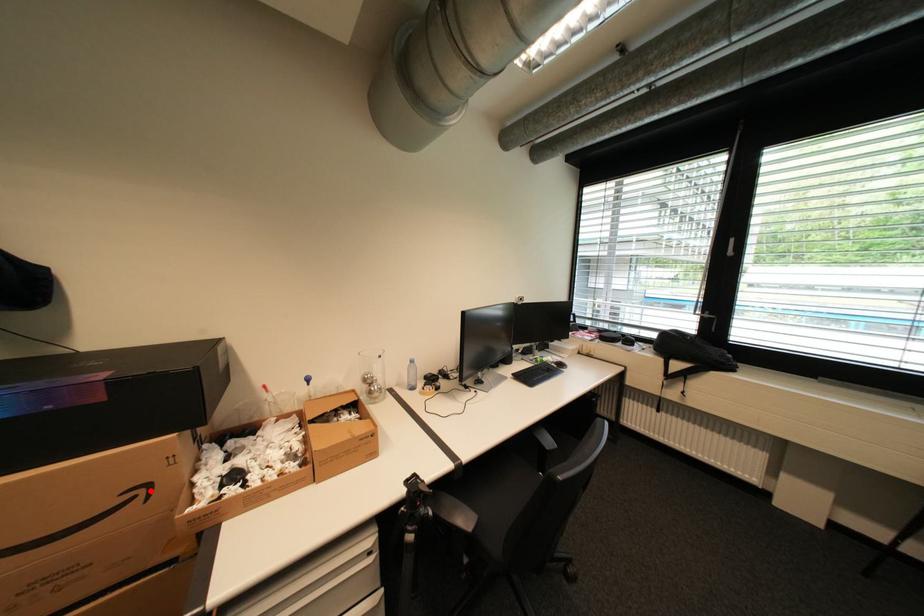
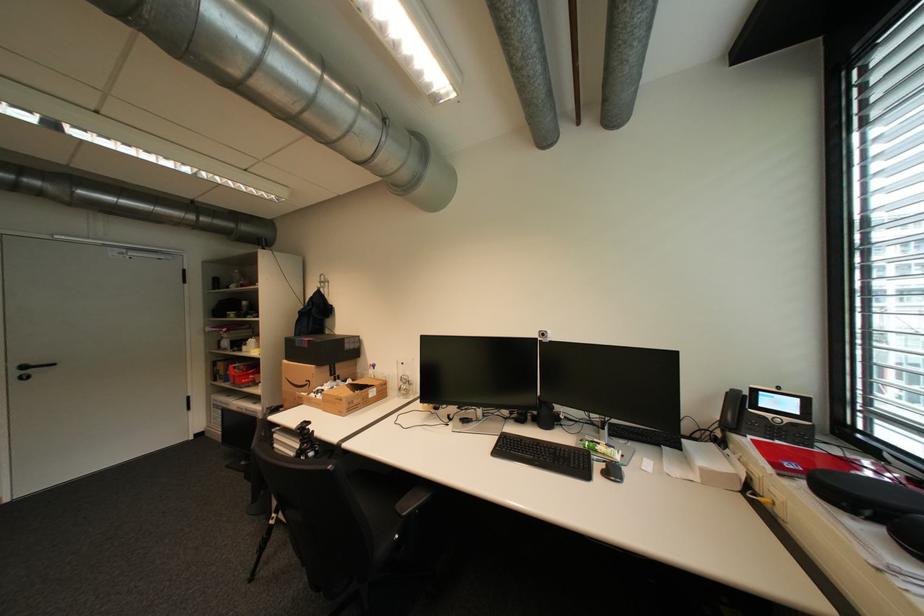
Where in the second image is the point corresponding to the highlighted location from the first image?

(317, 383)